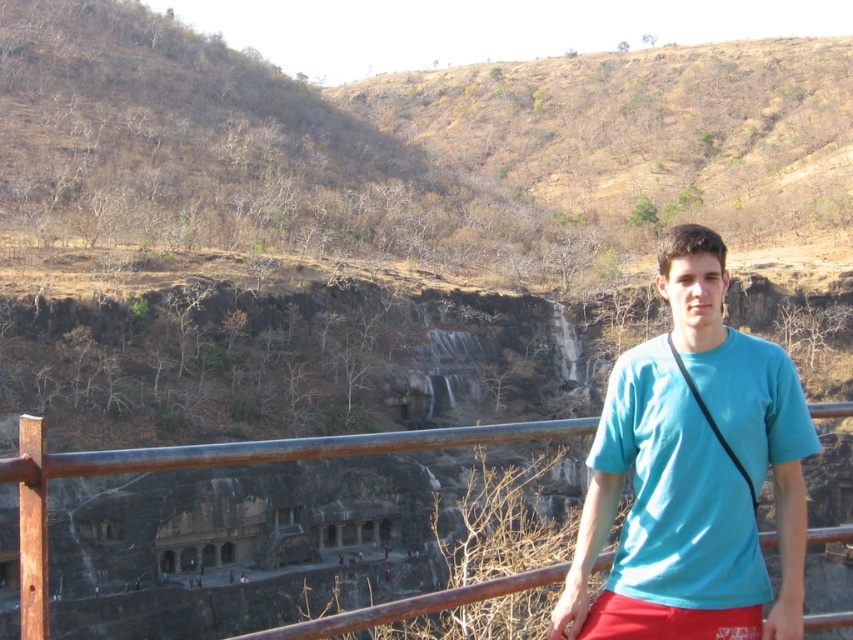
Question: Can you confirm if teal matte shirt at center is smaller than rusty metal fence at center?

Choices:
 (A) yes
 (B) no

Answer: (A)

Question: Which point is farther from the camera taking this photo?

Choices:
 (A) (628, 627)
 (B) (735, 392)

Answer: (B)

Question: Among these points, which one is farthest from the camera?

Choices:
 (A) (85, 461)
 (B) (671, 465)

Answer: (B)

Question: Is rusty metal fence at center smaller than red cotton shorts at lower right?

Choices:
 (A) yes
 (B) no

Answer: (B)

Question: Which point is farther from the camera taking this photo?

Choices:
 (A) (619, 605)
 (B) (402, 432)
 (C) (585, 536)

Answer: (B)

Question: Is rusty metal fence at center positioned before red cotton shorts at lower right?

Choices:
 (A) yes
 (B) no

Answer: (A)